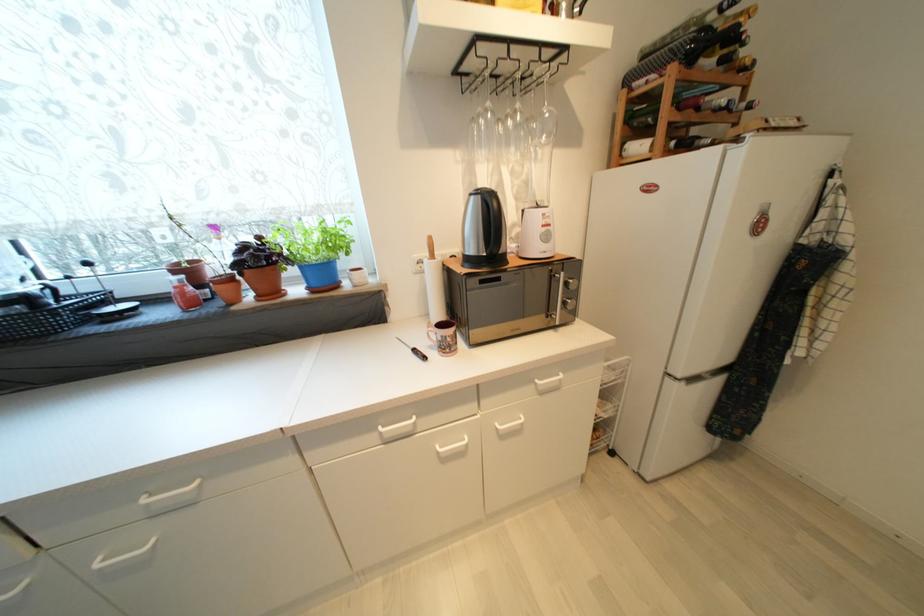
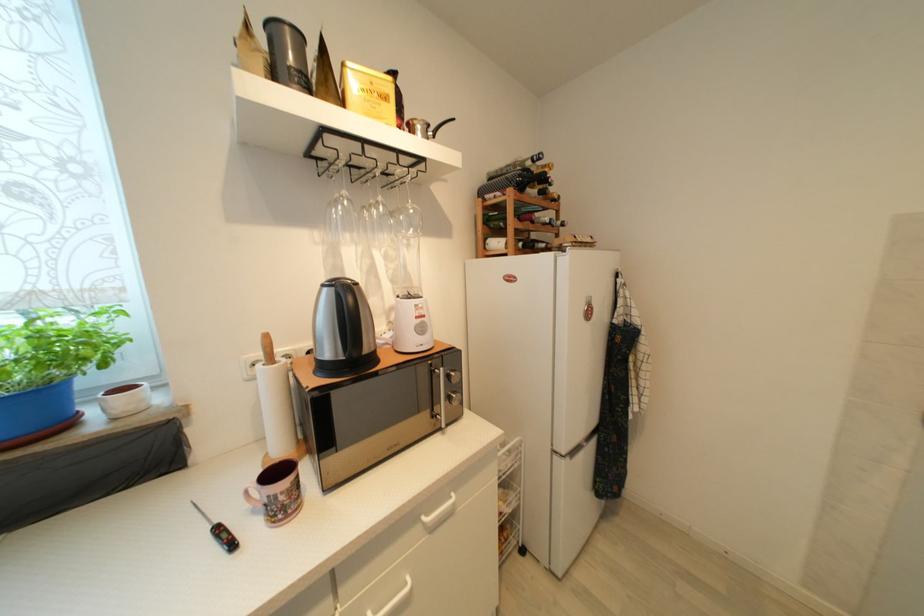
Locate, in the second image, the point that corresponds to point (548, 228) in the first image.

(421, 320)